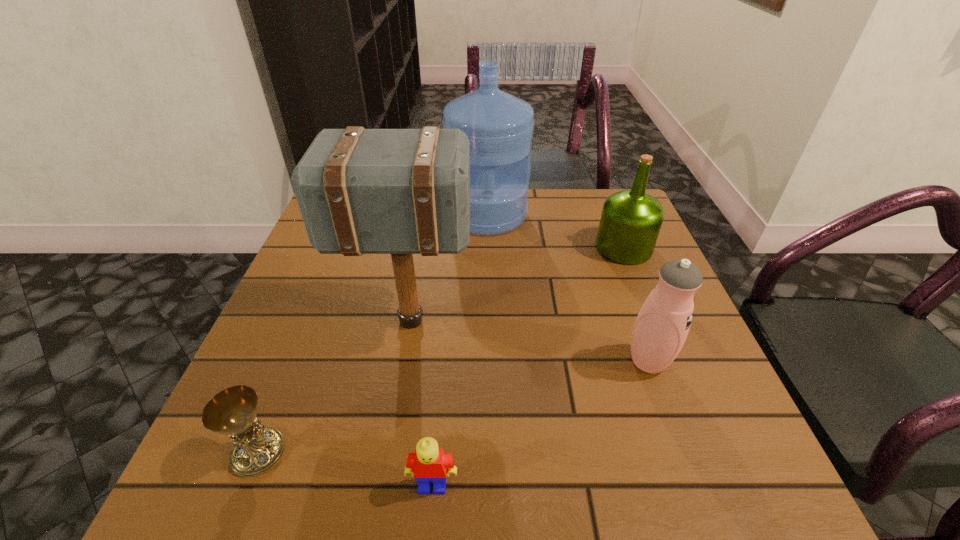
Image resolution: width=960 pixels, height=540 pixels. What are the coordinates of `free space located 0.360m on the back of the leftmost object` in the screenshot? It's located at (326, 282).

Locate an element on the screen. water jug situated at the far edge is located at coordinates (500, 126).

Where is `olive oil located at the far edge`? The image size is (960, 540). olive oil located at the far edge is located at coordinates (630, 222).

Image resolution: width=960 pixels, height=540 pixels. Identify the location of chalice that is positioned at the near edge. (257, 448).

Find the location of a particular element. Lego positioned at the near edge is located at coordinates (428, 464).

At what (x,y) coordinates should I click in order to perform the action: click on mallet at the left edge. Please return your answer as a coordinate pair (x, y). Looking at the image, I should click on (360, 191).

Locate an element on the screen. The width and height of the screenshot is (960, 540). chalice located in the left edge section of the desktop is located at coordinates (257, 448).

In order to click on olive oil at the right edge in this screenshot , I will do `click(630, 222)`.

Where is `thermos bottle that is positioned at the right edge`? thermos bottle that is positioned at the right edge is located at coordinates (662, 325).

Identify the location of object present at the near left corner. The image size is (960, 540). (257, 448).